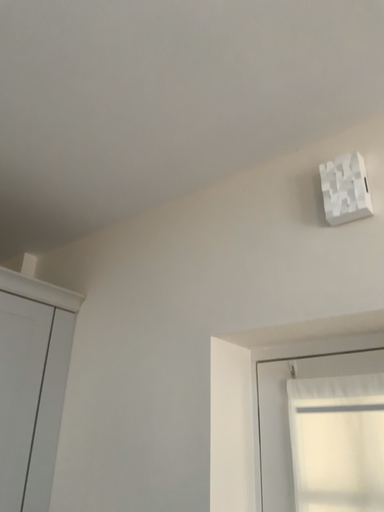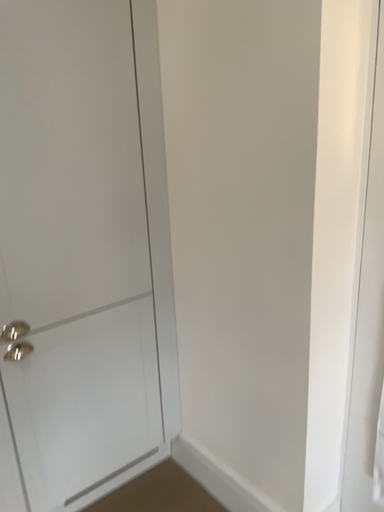
Question: Which way did the camera rotate in the video?

Choices:
 (A) rotated right
 (B) rotated left

Answer: (B)